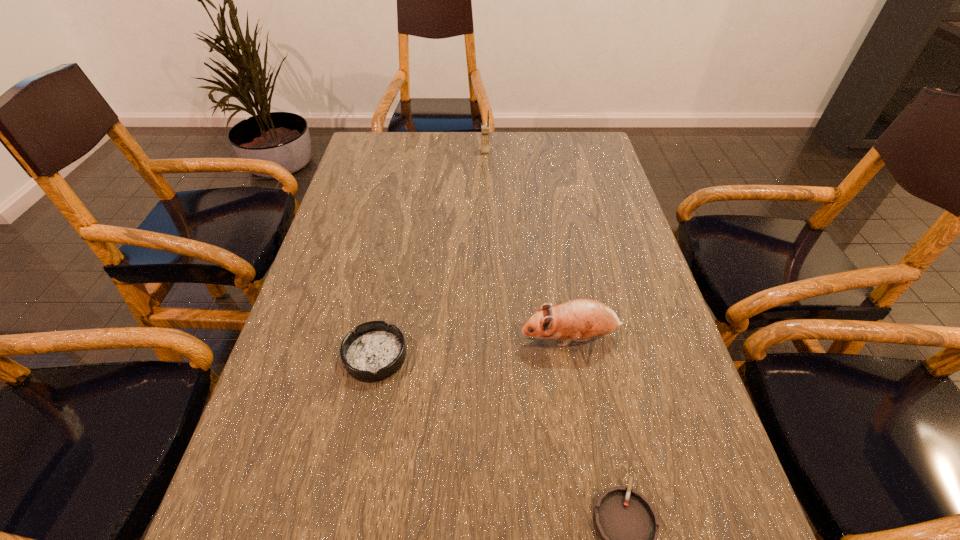
At what (x,y) coordinates should I click in order to perform the action: click on vacant point located between the left ashtray and the hamster. Please return your answer as a coordinate pair (x, y). This screenshot has width=960, height=540. Looking at the image, I should click on (472, 347).

Identify the location of the third closest object to the left ashtray. This screenshot has width=960, height=540. (484, 128).

Identify the location of the closest object to the shortest object. (582, 319).